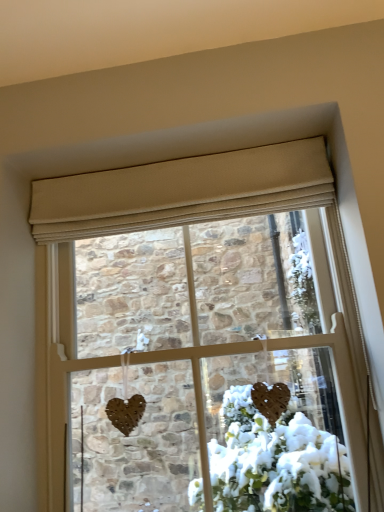
Question: Does matte brown heart at center come behind beige fabric curtain at upper center?

Choices:
 (A) yes
 (B) no

Answer: (B)

Question: From a real-world perspective, does matte brown heart at center sit lower than beige fabric curtain at upper center?

Choices:
 (A) no
 (B) yes

Answer: (B)

Question: Can you confirm if matte brown heart at center is thinner than beige fabric curtain at upper center?

Choices:
 (A) yes
 (B) no

Answer: (B)

Question: From the image's perspective, would you say matte brown heart at center is positioned over beige fabric curtain at upper center?

Choices:
 (A) yes
 (B) no

Answer: (B)

Question: From a real-world perspective, is matte brown heart at center physically above beige fabric curtain at upper center?

Choices:
 (A) no
 (B) yes

Answer: (A)

Question: Can you confirm if matte brown heart at center is taller than beige fabric curtain at upper center?

Choices:
 (A) yes
 (B) no

Answer: (A)

Question: From the image's perspective, is beige fabric curtain at upper center located beneath matte brown heart at center?

Choices:
 (A) yes
 (B) no

Answer: (B)

Question: Does beige fabric curtain at upper center have a smaller size compared to matte brown heart at center?

Choices:
 (A) no
 (B) yes

Answer: (B)

Question: Can you confirm if beige fabric curtain at upper center is positioned to the left of matte brown heart at center?

Choices:
 (A) no
 (B) yes

Answer: (B)

Question: From a real-world perspective, does beige fabric curtain at upper center sit lower than matte brown heart at center?

Choices:
 (A) no
 (B) yes

Answer: (A)

Question: Considering the relative sizes of beige fabric curtain at upper center and matte brown heart at center in the image provided, is beige fabric curtain at upper center wider than matte brown heart at center?

Choices:
 (A) no
 (B) yes

Answer: (A)

Question: From a real-world perspective, is beige fabric curtain at upper center physically above matte brown heart at center?

Choices:
 (A) yes
 (B) no

Answer: (A)

Question: Considering the positions of matte brown heart at center and beige fabric curtain at upper center in the image, is matte brown heart at center wider or thinner than beige fabric curtain at upper center?

Choices:
 (A) thin
 (B) wide

Answer: (B)